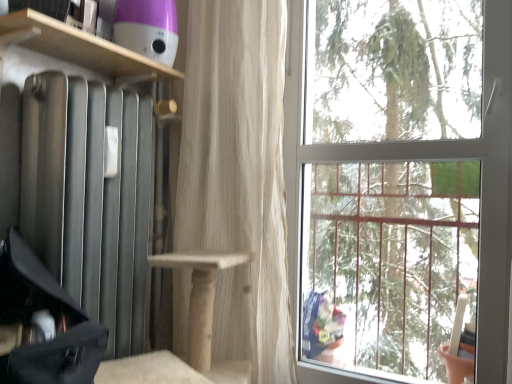
Question: Does point [181, 163] appear closer or farther from the camera than point [17, 238]?

Choices:
 (A) farther
 (B) closer

Answer: (A)

Question: Considering their positions, is white sheer curtain at center located in front of or behind black fabric suitcase at left?

Choices:
 (A) behind
 (B) front

Answer: (A)

Question: Considering the real-world distances, which object is farthest from the black fabric suitcase at left?

Choices:
 (A) white sheer curtain at center
 (B) wooden shelf at upper left
 (C) transparent glass window at upper right

Answer: (C)

Question: Estimate the real-world distances between objects in this image. Which object is farther from the white sheer curtain at center?

Choices:
 (A) wooden shelf at upper left
 (B) black fabric suitcase at left
 (C) transparent glass window at upper right

Answer: (B)